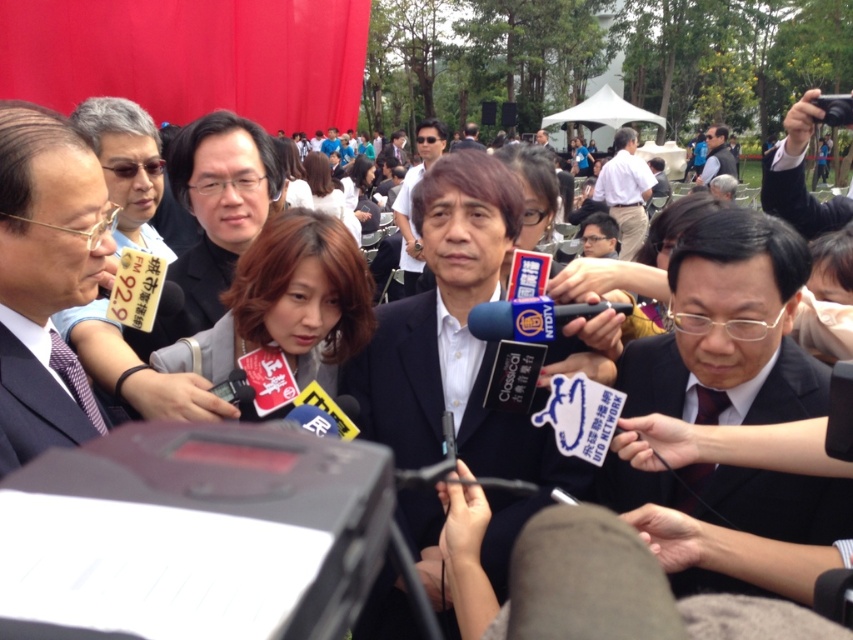
You are a photographer at the event and want to capture both the dark blue suit at center and the dark blue suit at left in a single frame. Based on their positions, which one should you focus on first to ensure both are in the frame?

The dark blue suit at center is below dark blue suit at left, so you should focus on the dark blue suit at left first to ensure both are in the frame.

You are a photographer at the event and need to capture both the matte black suit at left and the dark blue suit at left in a single frame. Which suit should you position closer to the center to ensure both are visible without cropping?

The matte black suit at left should be positioned closer to the center because it has a greater height than the dark blue suit at left, allowing both to fit within the frame more effectively.

You are a photographer standing at the camera position. You want to take a photo of the central figure in the scene. However, there is an obstacle at point (190, 138) that is 3.21 meters away from you. Can you estimate if this obstacle will block your direct line of sight to the central figure?

The obstacle at point (190, 138) is 3.21 meters away from the camera. Since the central figure is likely positioned closer than this distance, the obstacle might be between the camera and the central figure, potentially blocking the direct line of sight. However, without knowing the exact distance of the central figure from the camera, it is impossible to definitively determine if the obstacle blocks the view.